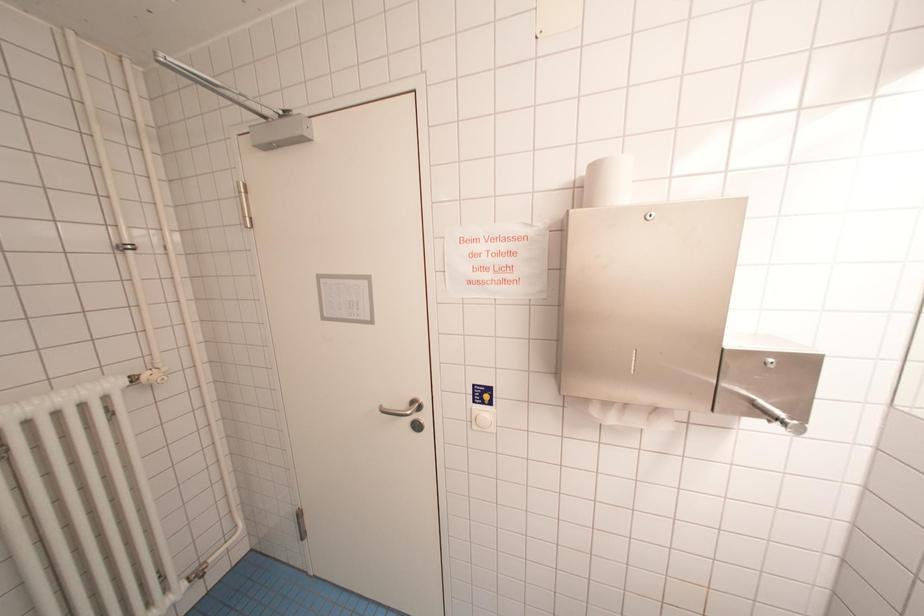
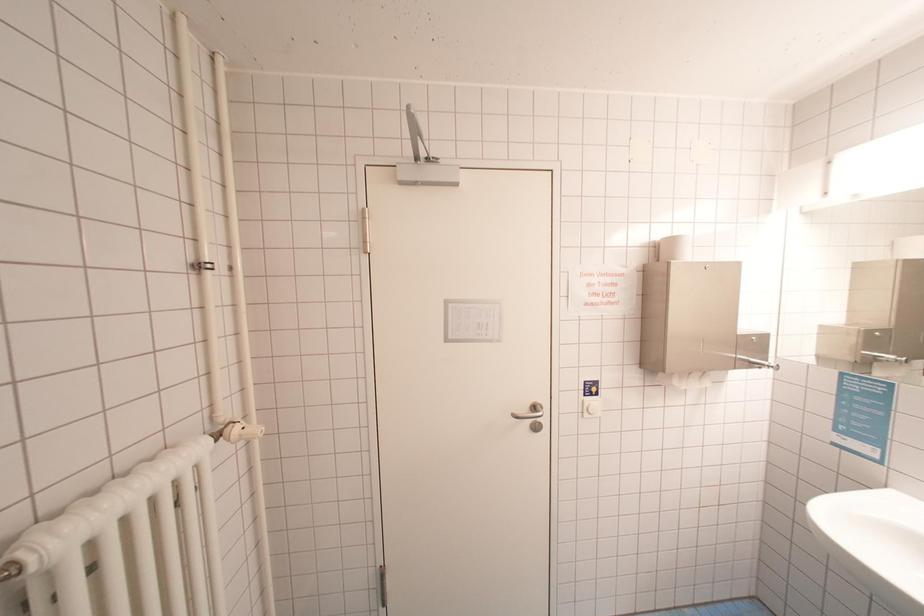
Question: The images are taken continuously from a first-person perspective. In which direction are you moving?

Choices:
 (A) Left
 (B) Right
 (C) Forward
 (D) Backward

Answer: (A)